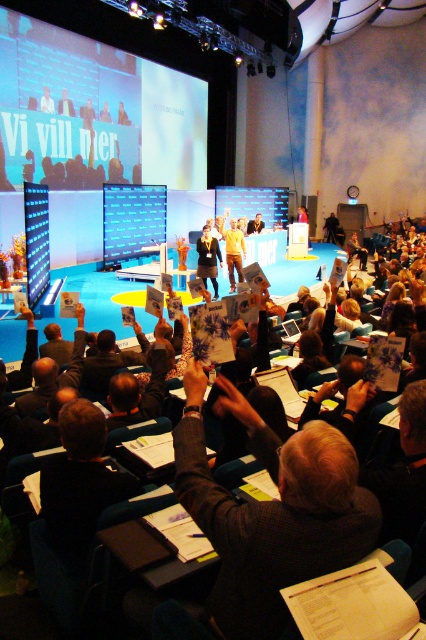
Consider the image. You are an attendee at the event and want to take a photo of the dark gray suit at center and the matte blue projection screen at center. Which object is closer to the camera based on their positions?

The dark gray suit at center is positioned under the matte blue projection screen at center, so the dark gray suit at center is closer to the camera.

You are an event organizer who needs to ensure that the dark gray suit at center and the yellow fabric at center are visible to all attendees. Given that the stage has limited space, which object should you prioritize placing closer to the front to ensure visibility?

The dark gray suit at center has a larger width than the yellow fabric at center, so to ensure visibility for both, the dark gray suit at center should be placed closer to the front since its greater width might make it more prominent and easier to see from a distance.